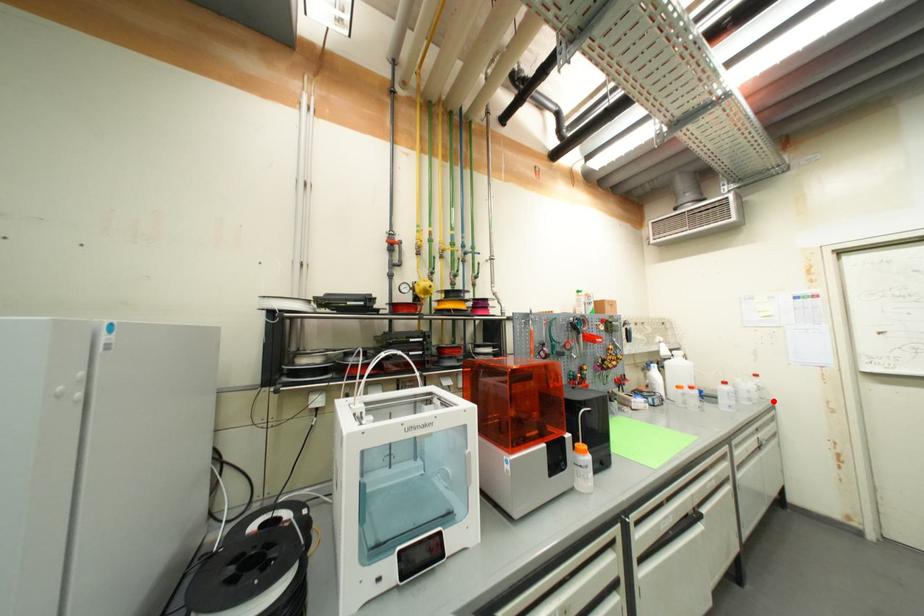
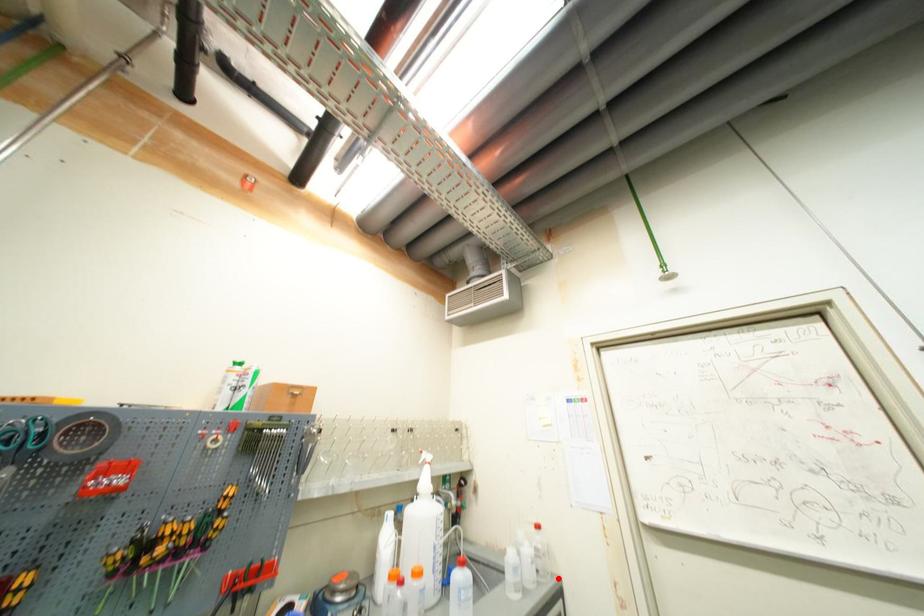
I am providing you with two images of the same scene from different viewpoints. A red point is marked on the first image and another point is marked on the second image. Are the points marked in image1 and image2 representing the same 3D position?

Yes